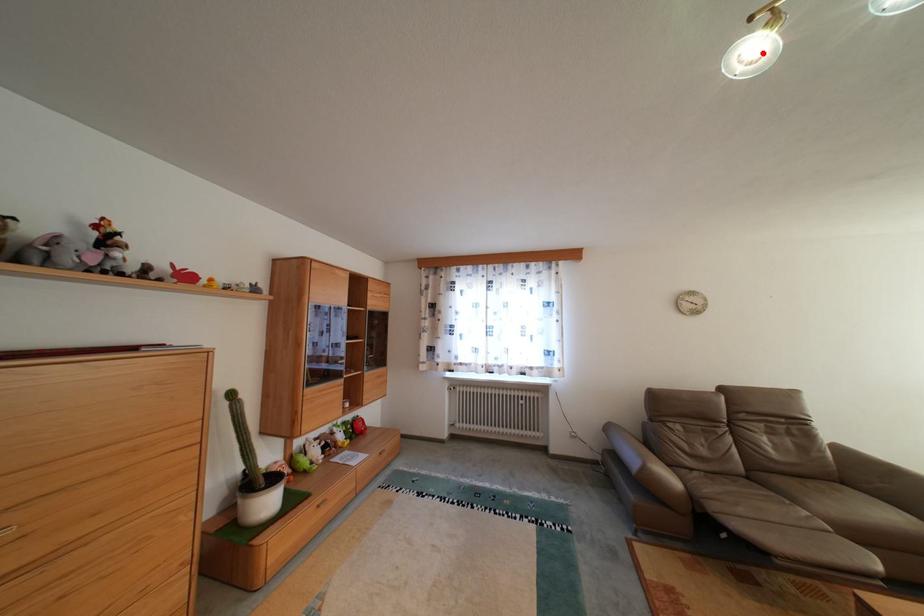
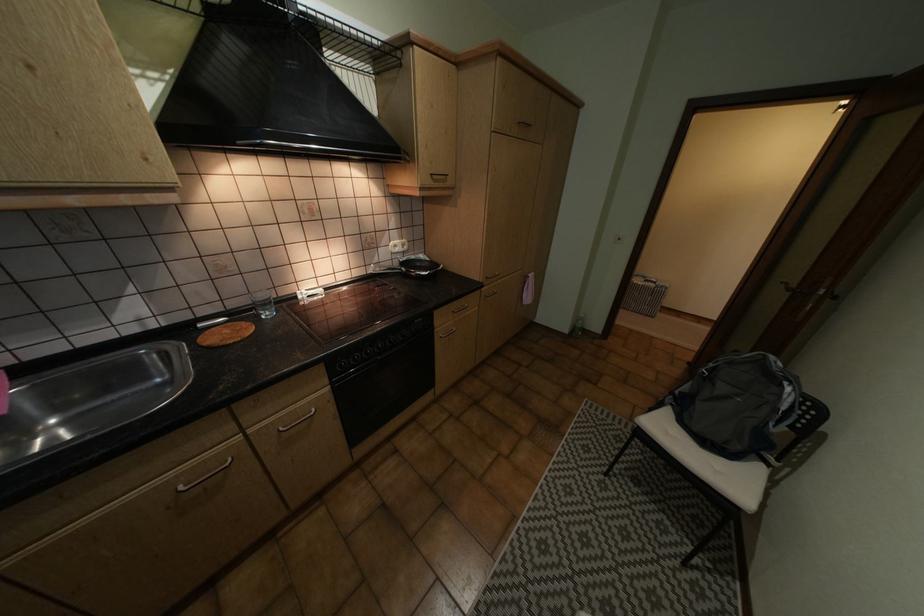
Question: I am providing you with two images of the same scene from different viewpoints. A red point is marked on the first image. Can you still see the location of the red point in image 2?

Choices:
 (A) Yes
 (B) No

Answer: (B)